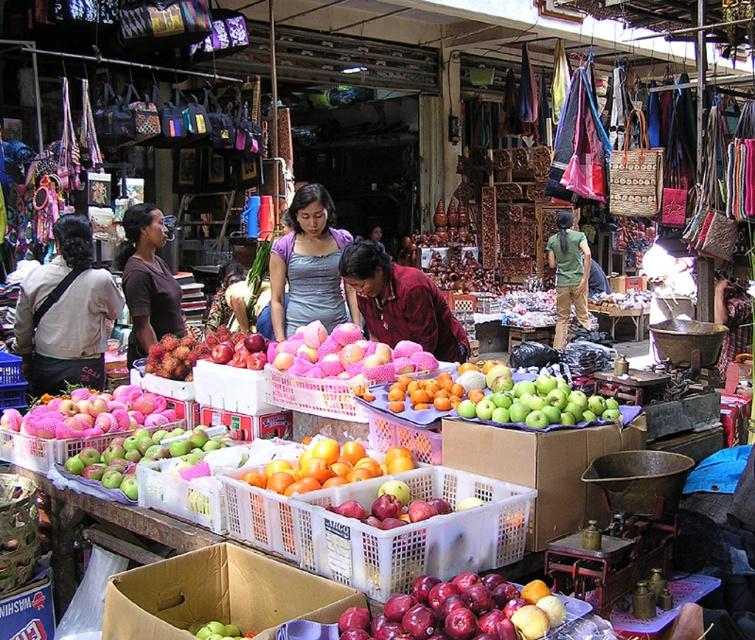
From the picture: Can you confirm if cardboard box filled with apples at center is smaller than purple matte shirt at center?

Correct, cardboard box filled with apples at center occupies less space than purple matte shirt at center.

Does point (242, 611) lie in front of point (319, 276)?

That is True.

What do you see at coordinates (217, 595) in the screenshot? The width and height of the screenshot is (755, 640). I see `cardboard box filled with apples at center` at bounding box center [217, 595].

You are a GUI agent. You are given a task and a screenshot of the screen. Output one action in this format:
    pyautogui.click(x=<x>, y=<y>)
    Task: Click on the cardboard box filled with apples at center
    Image resolution: width=755 pixels, height=640 pixels.
    Given the screenshot: What is the action you would take?
    pyautogui.click(x=217, y=595)

Is point (293, 340) closer to camera compared to point (421, 408)?

That is False.

Identify the location of pink mesh bag at center. (344, 355).

Between point (562, 259) and point (433, 388), which one is positioned behind?

The point (562, 259) is more distant.

Does point (578, 278) come closer to viewer compared to point (501, 374)?

No, (578, 278) is further to viewer.

What do you see at coordinates (569, 273) in the screenshot? The image size is (755, 640). I see `green cotton shirt at center` at bounding box center [569, 273].

The height and width of the screenshot is (640, 755). Identify the location of green cotton shirt at center. (569, 273).